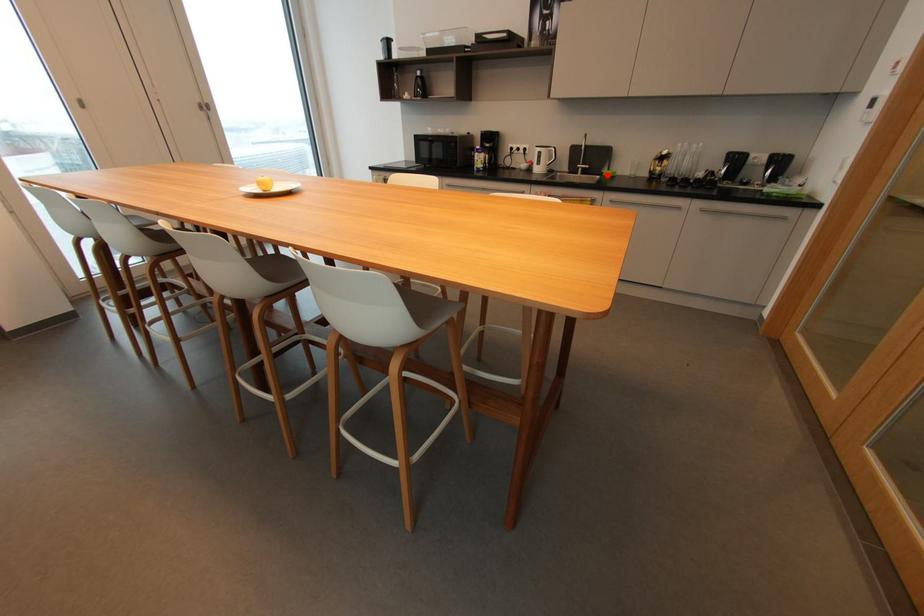
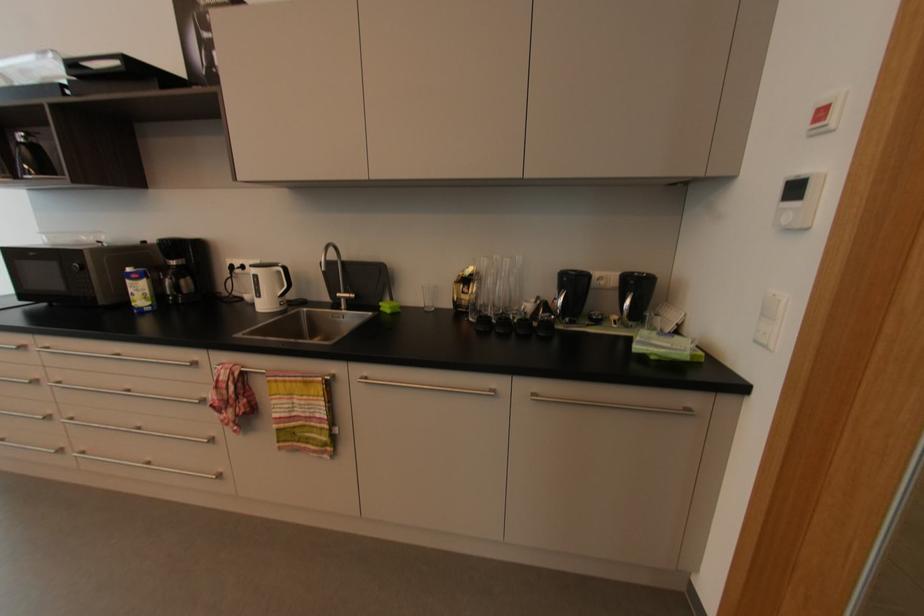
In the second image, find the point that corresponds to the highlighted location in the first image.

(384, 309)